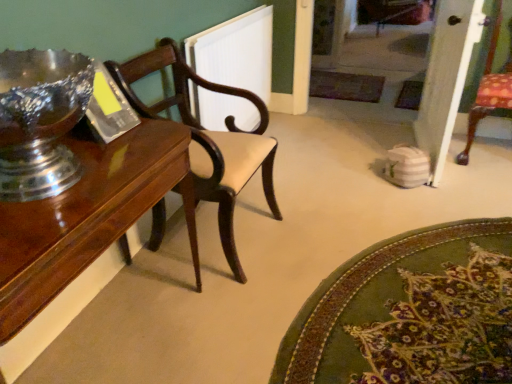
Question: Would you say green textured rug at lower right is inside or outside shiny wood table at left?

Choices:
 (A) outside
 (B) inside

Answer: (A)

Question: In the image, is green textured rug at lower right positioned in front of or behind shiny wood table at left?

Choices:
 (A) front
 (B) behind

Answer: (B)

Question: Considering the real-world distances, which object is closest to the green textured rug at lower right?

Choices:
 (A) white textured radiator at upper center
 (B) mahogany wood chair at left
 (C) shiny wood table at left

Answer: (B)

Question: Considering the real-world distances, which object is closest to the shiny wood table at left?

Choices:
 (A) white textured radiator at upper center
 (B) green textured rug at lower right
 (C) mahogany wood chair at left

Answer: (C)